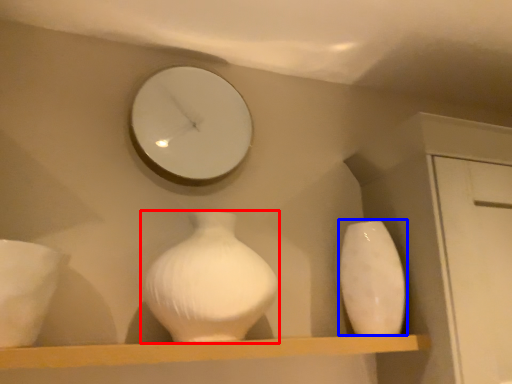
Question: Which object is closer to the camera taking this photo, vase (highlighted by a red box) or vase (highlighted by a blue box)?

Choices:
 (A) vase
 (B) vase

Answer: (A)